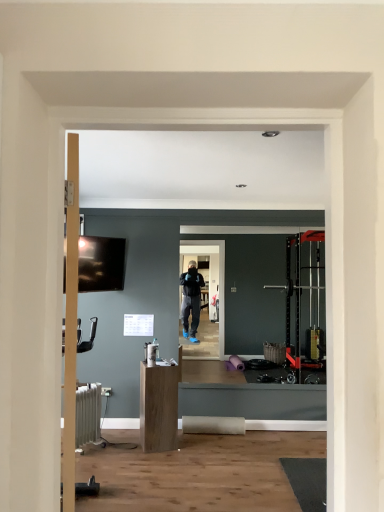
Question: Is matte black tv at upper left completely or partially outside of white metallic radiator at lower left?

Choices:
 (A) yes
 (B) no

Answer: (A)

Question: Does matte black tv at upper left have a larger size compared to white metallic radiator at lower left?

Choices:
 (A) no
 (B) yes

Answer: (A)

Question: Is matte black tv at upper left facing towards white metallic radiator at lower left?

Choices:
 (A) yes
 (B) no

Answer: (B)

Question: From the image's perspective, is matte black tv at upper left on top of white metallic radiator at lower left?

Choices:
 (A) yes
 (B) no

Answer: (A)

Question: Can you confirm if matte black tv at upper left is taller than white metallic radiator at lower left?

Choices:
 (A) no
 (B) yes

Answer: (B)

Question: Considering the positions of point (152, 434) and point (77, 407), is point (152, 434) closer or farther from the camera than point (77, 407)?

Choices:
 (A) farther
 (B) closer

Answer: (A)

Question: In terms of width, does light brown wood cabinet at center look wider or thinner when compared to white metallic radiator at lower left?

Choices:
 (A) thin
 (B) wide

Answer: (B)

Question: Is light brown wood cabinet at center to the left or to the right of white metallic radiator at lower left in the image?

Choices:
 (A) right
 (B) left

Answer: (A)

Question: Based on their sizes in the image, would you say light brown wood cabinet at center is bigger or smaller than white metallic radiator at lower left?

Choices:
 (A) big
 (B) small

Answer: (A)

Question: Would you say matte black tv at upper left is inside or outside light brown wood cabinet at center?

Choices:
 (A) inside
 (B) outside

Answer: (B)

Question: Would you say matte black tv at upper left is to the left or to the right of light brown wood cabinet at center in the picture?

Choices:
 (A) left
 (B) right

Answer: (A)

Question: From the image's perspective, is matte black tv at upper left located above or below light brown wood cabinet at center?

Choices:
 (A) above
 (B) below

Answer: (A)

Question: Looking at their shapes, would you say matte black tv at upper left is wider or thinner than light brown wood cabinet at center?

Choices:
 (A) thin
 (B) wide

Answer: (A)

Question: From a real-world perspective, is white metallic radiator at lower left positioned above or below matte black tv at upper left?

Choices:
 (A) above
 (B) below

Answer: (B)

Question: In the image, is white metallic radiator at lower left positioned in front of or behind matte black tv at upper left?

Choices:
 (A) behind
 (B) front

Answer: (B)